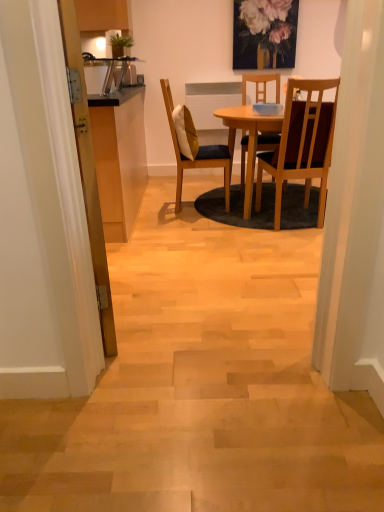
The image size is (384, 512). Identify the location of vacant space in front of brown wooden chair at center, marked as the second chair in a left-to-right arrangement. (288, 241).